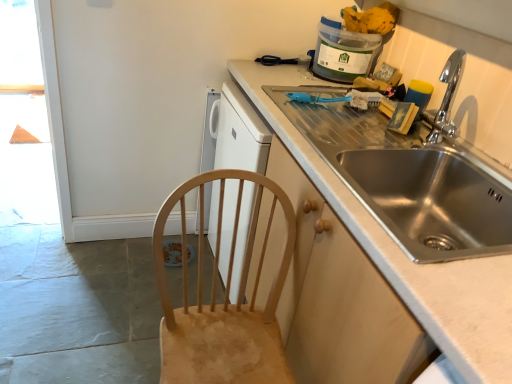
Question: Should I look upward or downward to see translucent plastic container at upper right?

Choices:
 (A) up
 (B) down

Answer: (A)

Question: Is translucent plastic container at upper right smaller than stainless steel sink at right?

Choices:
 (A) no
 (B) yes

Answer: (B)

Question: Considering the relative sizes of translucent plastic container at upper right and stainless steel sink at right in the image provided, is translucent plastic container at upper right bigger than stainless steel sink at right?

Choices:
 (A) yes
 (B) no

Answer: (B)

Question: From the image's perspective, would you say translucent plastic container at upper right is shown under stainless steel sink at right?

Choices:
 (A) no
 (B) yes

Answer: (A)

Question: Considering the relative sizes of translucent plastic container at upper right and stainless steel sink at right in the image provided, is translucent plastic container at upper right shorter than stainless steel sink at right?

Choices:
 (A) no
 (B) yes

Answer: (B)

Question: From a real-world perspective, does translucent plastic container at upper right stand above stainless steel sink at right?

Choices:
 (A) no
 (B) yes

Answer: (B)

Question: From the image's perspective, is translucent plastic container at upper right above stainless steel sink at right?

Choices:
 (A) yes
 (B) no

Answer: (A)

Question: From a real-world perspective, is stainless steel sink at right over translucent plastic container at upper right?

Choices:
 (A) no
 (B) yes

Answer: (A)

Question: From the image's perspective, would you say stainless steel sink at right is positioned over translucent plastic container at upper right?

Choices:
 (A) no
 (B) yes

Answer: (A)

Question: Is stainless steel sink at right shorter than translucent plastic container at upper right?

Choices:
 (A) yes
 (B) no

Answer: (B)

Question: Is stainless steel sink at right oriented away from translucent plastic container at upper right?

Choices:
 (A) no
 (B) yes

Answer: (A)

Question: Is there a large distance between stainless steel sink at right and translucent plastic container at upper right?

Choices:
 (A) no
 (B) yes

Answer: (A)

Question: From the image's perspective, is stainless steel sink at right located beneath translucent plastic container at upper right?

Choices:
 (A) no
 (B) yes

Answer: (B)

Question: Is stainless steel sink at right outside natural wood chair at lower left?

Choices:
 (A) yes
 (B) no

Answer: (A)